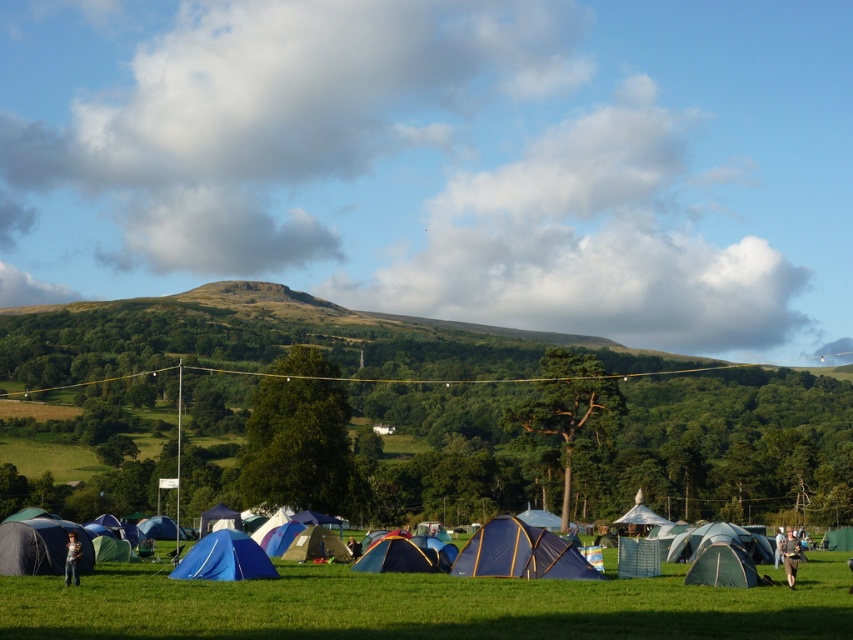
You are a camper trying to locate your green fabric tent at center and blue fabric tent at lower left in the camping area. From the perspective of someone standing at the edge of the field facing the tents, which tent is positioned lower in the image?

The green fabric tent at center is located below the blue fabric tent at lower left, so the green fabric tent at center is positioned lower in the image.

You are a hiker who wants to set up a new tent in the camping area. You see the blue fabric tents at lower center and the blue fabric tent at center. Which of these two tents is positioned lower in the image?

The blue fabric tents at lower center is positioned lower in the image than the blue fabric tent at center.

You are a camper who wants to set up a new tent in this area. You have a tall tent that requires at least 2 meters of clearance. Looking at the green fabric tent at center and the blue fabric tent at lower left, which tent would be a better reference for ensuring your tent has enough space?

The green fabric tent at center is taller than the blue fabric tent at lower left. Since your tent requires at least 2 meters of clearance, you should use the green fabric tent at center as a reference because it is taller and more likely to meet the height requirement.